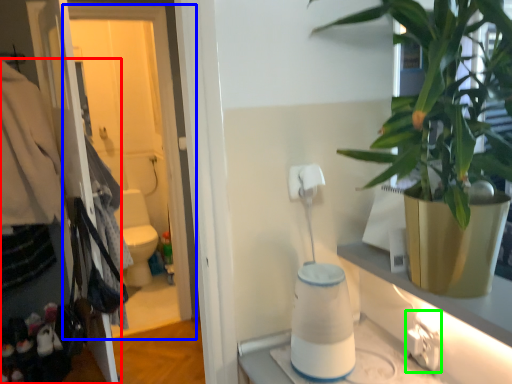
Question: Which is farther away from closet (highlighted by a red box)? screen door (highlighted by a blue box) or electric outlet (highlighted by a green box)?

Choices:
 (A) screen door
 (B) electric outlet

Answer: (B)